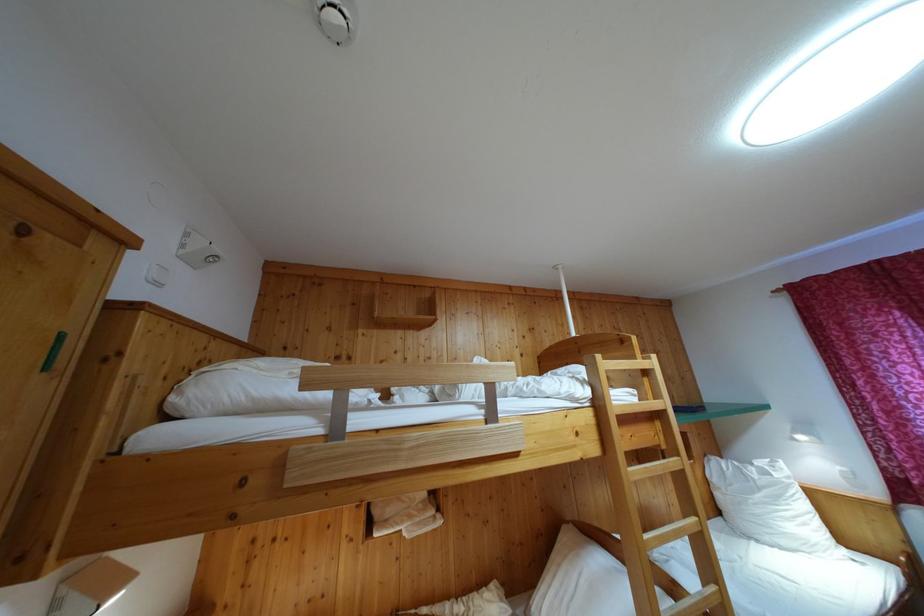
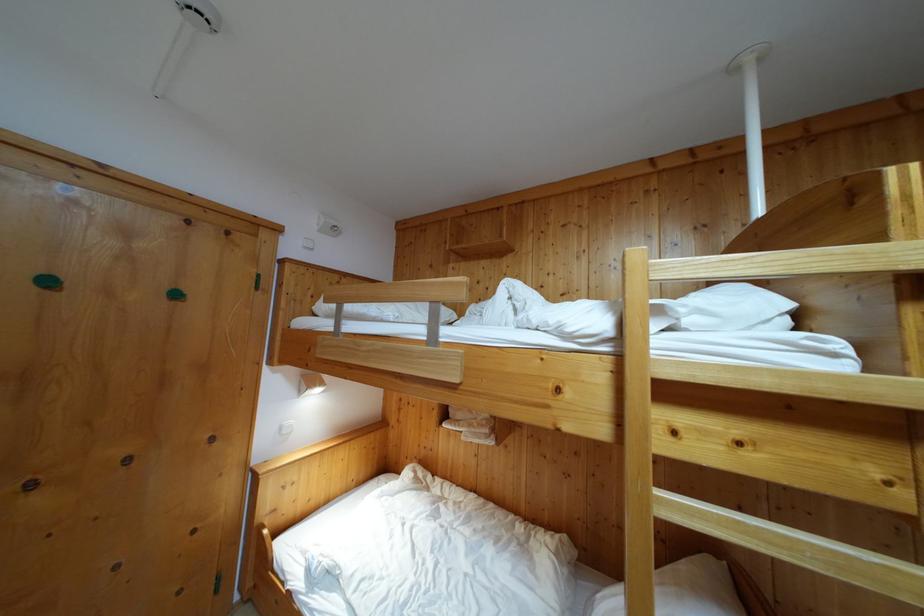
Find the pixel in the second image that matches the point at 363,345 in the first image.

(455, 278)